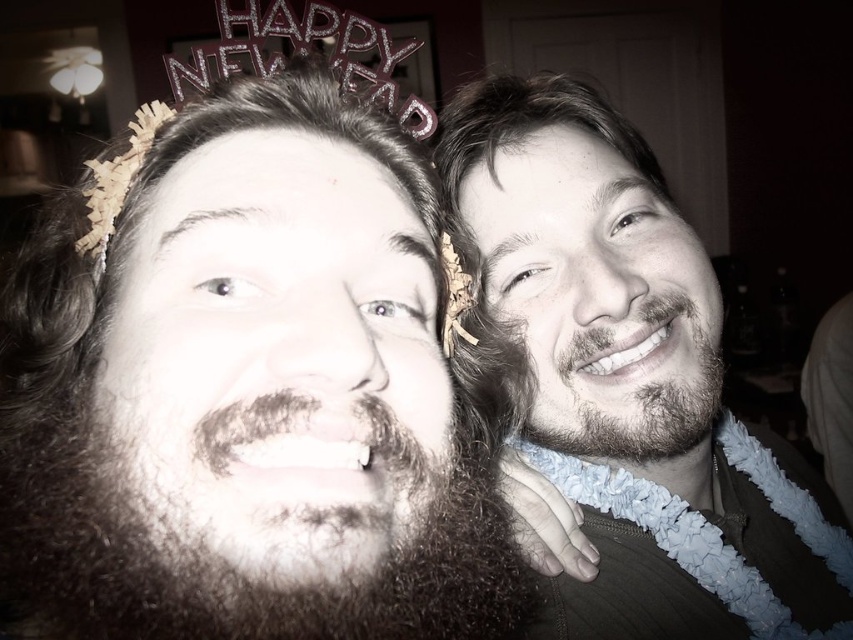
Can you confirm if dark brown hair at upper right is positioned below dark brown fuzzy beard at right?

Actually, dark brown hair at upper right is above dark brown fuzzy beard at right.

Which is above, dark brown hair at upper right or dark brown fuzzy beard at right?

dark brown hair at upper right is above.

Identify the location of dark brown hair at upper right. The height and width of the screenshot is (640, 853). (529, 125).

Is point (641, 417) farther from viewer compared to point (149, 108)?

No, it is not.

Who is taller, dark brown fuzzy beard at right or wooden beads at left?

wooden beads at left is taller.

Where is `dark brown fuzzy beard at right`? This screenshot has height=640, width=853. dark brown fuzzy beard at right is located at coordinates (651, 406).

Find the location of a particular element. dark brown fuzzy beard at right is located at coordinates (651, 406).

Between dark brown fuzzy beard at lower left and dark brown fuzzy beard at right, which one is positioned higher?

dark brown fuzzy beard at right is above.

Does dark brown fuzzy beard at lower left have a lesser width compared to dark brown fuzzy beard at right?

In fact, dark brown fuzzy beard at lower left might be wider than dark brown fuzzy beard at right.

Find the location of `dark brown fuzzy beard at lower left`. dark brown fuzzy beard at lower left is located at coordinates (228, 564).